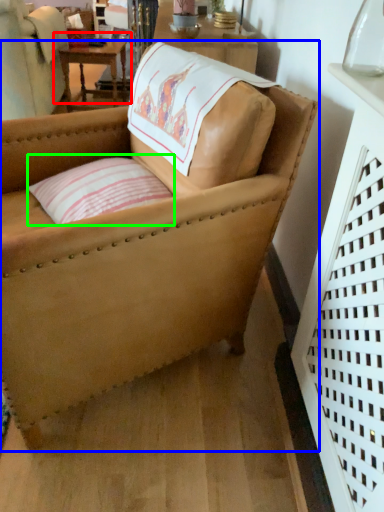
Question: Which object is the farthest from table (highlighted by a red box)? Choose among these: chair (highlighted by a blue box) or pillow (highlighted by a green box).

Choices:
 (A) chair
 (B) pillow

Answer: (A)